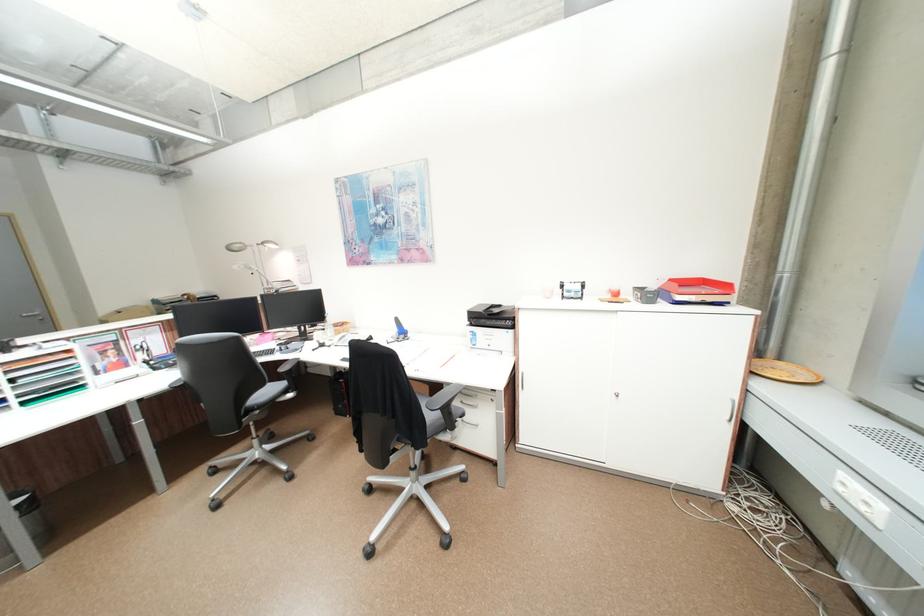
Find where to insert the cabinet keyhole. Please return your answer as a coordinate pair (x, y).

(550, 413)